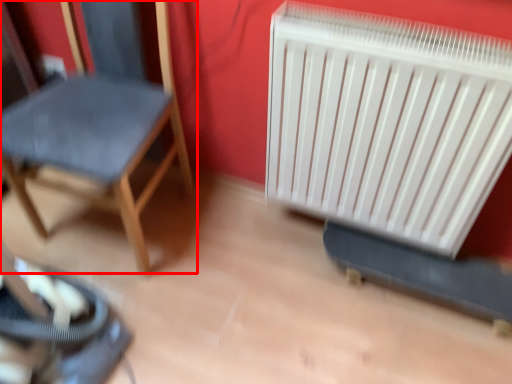
Question: In this image, where is chair (annotated by the red box) located relative to radiator?

Choices:
 (A) left
 (B) right

Answer: (A)